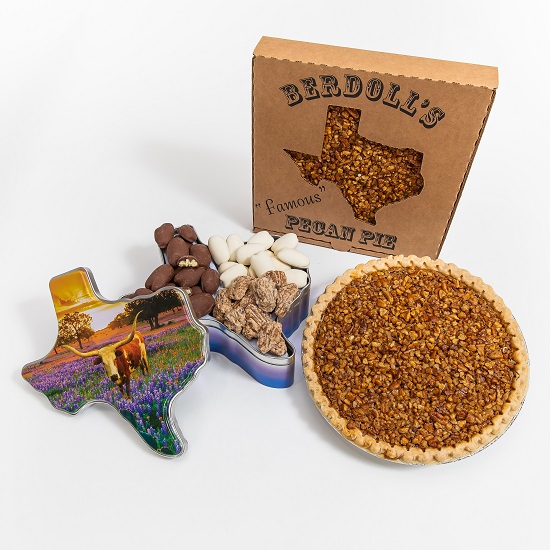
Locate an element on the screen. The height and width of the screenshot is (550, 550). box is located at coordinates tap(445, 139).